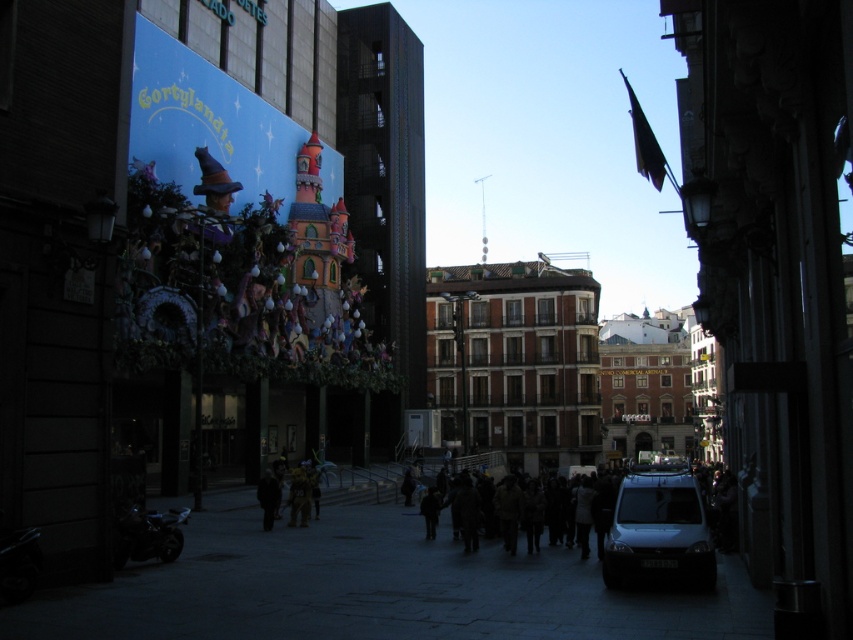
Question: In this image, where is black matte van at center located relative to white matte van at lower right?

Choices:
 (A) below
 (B) above

Answer: (B)

Question: Which is nearer to the dark brown fabric crowd at center?

Choices:
 (A) white matte van at lower right
 (B) black matte jacket at center
 (C) black matte van at center

Answer: (C)

Question: Can you confirm if white matte van at lower right is positioned to the left of dark brown fabric crowd at center?

Choices:
 (A) no
 (B) yes

Answer: (A)

Question: Is white matte van at lower right bigger than black matte jacket at center?

Choices:
 (A) yes
 (B) no

Answer: (A)

Question: Which of the following is the closest to the observer?

Choices:
 (A) (466, 550)
 (B) (262, 496)

Answer: (A)

Question: Which object is the closest to the white matte van at lower right?

Choices:
 (A) dark brown fabric crowd at center
 (B) black matte van at center
 (C) black matte jacket at center

Answer: (A)